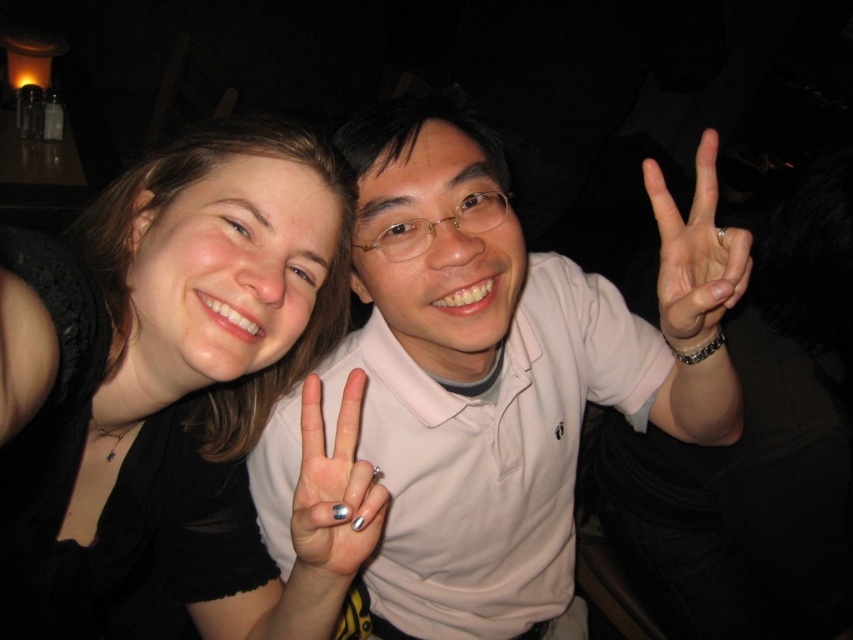
You are a photographer adjusting the focus on a camera. The camera can only focus on objects within a 5 inch radius. You see the black matte shirt at center and the silver metallic nails at center in the frame. Will both objects be in focus?

The black matte shirt at center and silver metallic nails at center are 5.88 inches apart from each other. Since the camera can only focus on objects within a 5 inch radius, the distance between them exceeds the focus range. Therefore, both objects cannot be in focus simultaneously.

You are a photographer setting up for a group photo. You notice two hands in the frame, one with silver metallic nails at center and another white matte hand at center. To ensure both hands are visible in the photo, which hand should be moved to the right to avoid overlapping?

The silver metallic nails at center should be moved to the right since it is currently to the left of the white matte hand at center, so moving it right would prevent overlap.

You are a photographer adjusting the focus on your camera. You need to ensure that the point at coordinate point (129, 236) is in focus. What is the minimum distance in centimeters you should set your camera focus to capture this point clearly?

The minimum distance to set the camera focus is 77.76 centimeters because the point (129, 236) is located exactly 77.76 centimeters away from the camera.